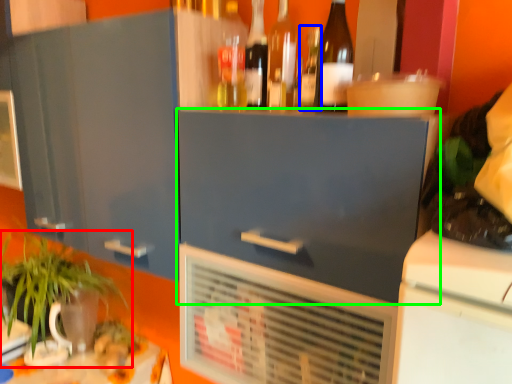
Question: Which object is the closest to the houseplant (highlighted by a red box)? Choose among these: bottle (highlighted by a blue box) or cabinetry (highlighted by a green box).

Choices:
 (A) bottle
 (B) cabinetry

Answer: (B)